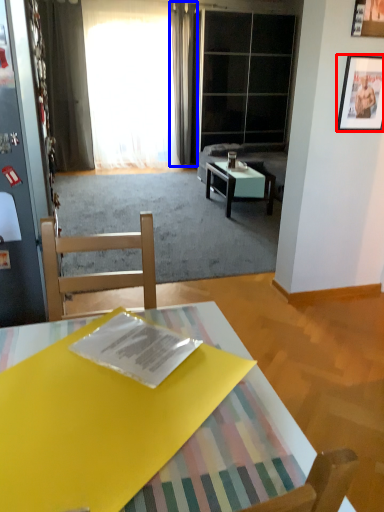
Question: Among these objects, which one is nearest to the camera, picture frame (highlighted by a red box) or curtain (highlighted by a blue box)?

Choices:
 (A) picture frame
 (B) curtain

Answer: (A)